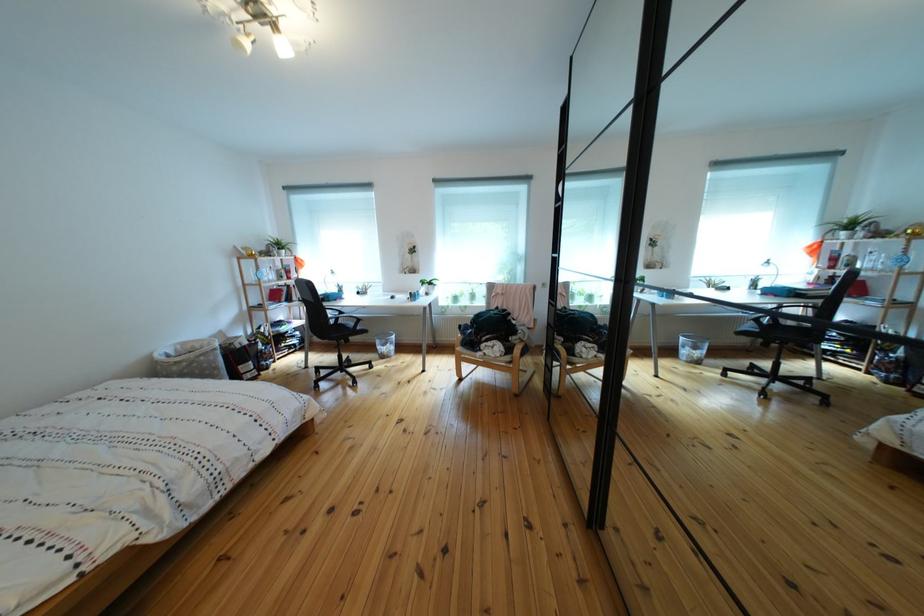
Which object does [770,268] point to?

It corresponds to the white desk lamp in the image.